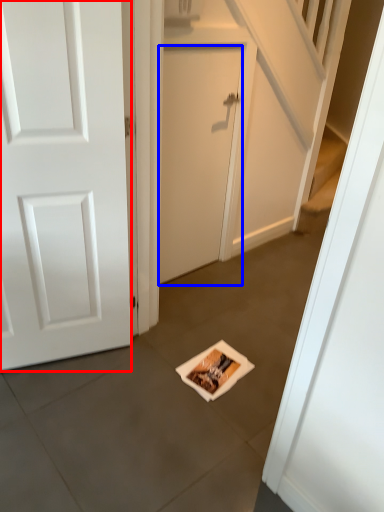
Question: Which of the following is the closest to the observer, door (highlighted by a red box) or door (highlighted by a blue box)?

Choices:
 (A) door
 (B) door

Answer: (A)